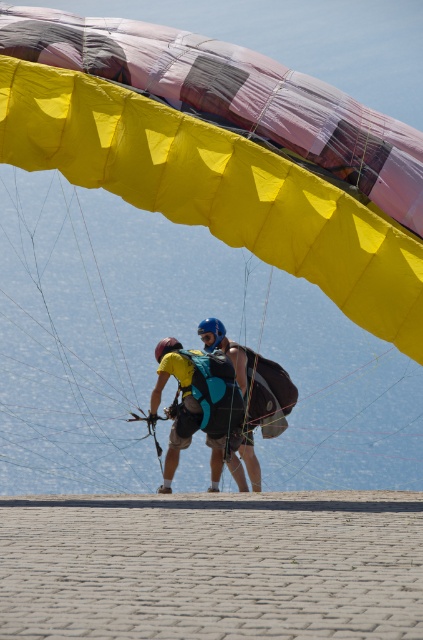
Question: Considering the relative positions of yellow matte helmet at upper center and blue fabric backpack at center in the image provided, where is yellow matte helmet at upper center located with respect to blue fabric backpack at center?

Choices:
 (A) left
 (B) right

Answer: (A)

Question: Which object appears closest to the camera in this image?

Choices:
 (A) yellow matte helmet at upper center
 (B) blue fabric backpack at center

Answer: (A)

Question: Does yellow matte helmet at upper center have a greater width compared to blue fabric backpack at center?

Choices:
 (A) yes
 (B) no

Answer: (A)

Question: Among these objects, which one is farthest from the camera?

Choices:
 (A) yellow matte helmet at upper center
 (B) blue fabric backpack at center

Answer: (B)

Question: Does yellow matte helmet at upper center have a larger size compared to blue fabric backpack at center?

Choices:
 (A) yes
 (B) no

Answer: (A)

Question: Among these points, which one is nearest to the camera?

Choices:
 (A) (216, 474)
 (B) (252, 474)

Answer: (A)